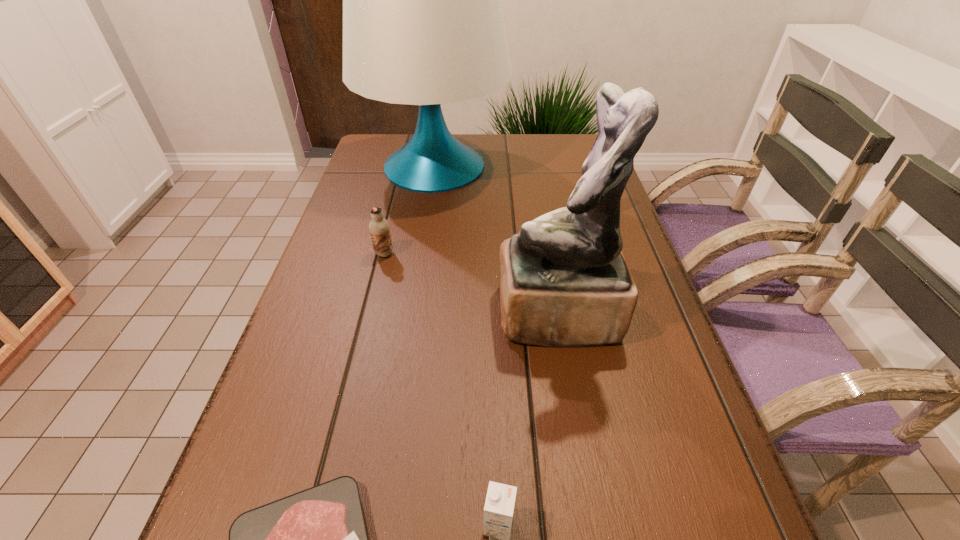
The height and width of the screenshot is (540, 960). In order to click on vacant space in between the third nearest object and the tallest object in this screenshot , I will do `click(496, 240)`.

The height and width of the screenshot is (540, 960). In order to click on empty location between the tallest object and the second farthest object in this screenshot , I will do `click(410, 210)`.

Locate which object ranks third in proximity to the second shortest object. Please provide its 2D coordinates. Your answer should be formatted as a tuple, i.e. [(x, y)], where the tuple contains the x and y coordinates of a point satisfying the conditions above.

[(379, 228)]

You are a GUI agent. You are given a task and a screenshot of the screen. Output one action in this format:
    pyautogui.click(x=<x>, y=<y>)
    Task: Click on the object that is the third closest one to the table lamp
    This screenshot has height=540, width=960.
    Given the screenshot: What is the action you would take?
    pyautogui.click(x=316, y=539)

Choose which chocolate milk is the second nearest neighbor to the farthest object. Please provide its 2D coordinates. Your answer should be formatted as a tuple, i.e. [(x, y)], where the tuple contains the x and y coordinates of a point satisfying the conditions above.

[(499, 506)]